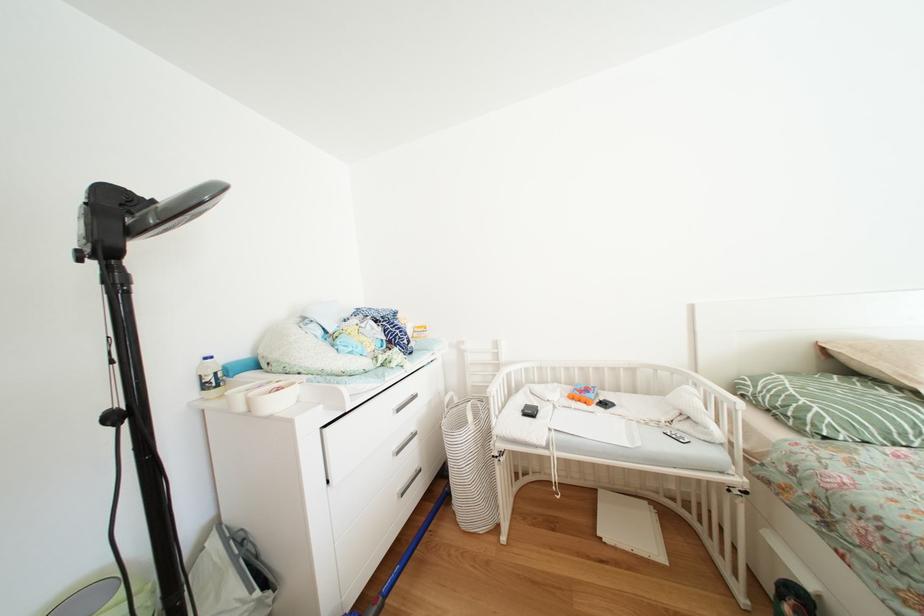
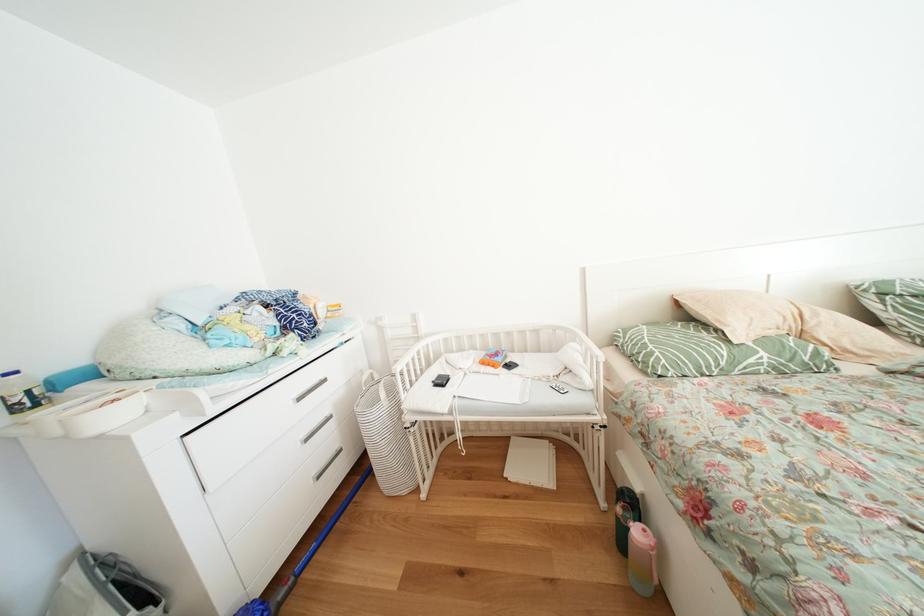
Question: In a continuous first-person perspective shot, in which direction is the camera moving?

Choices:
 (A) Left
 (B) Right
 (C) Forward
 (D) Backward

Answer: (B)